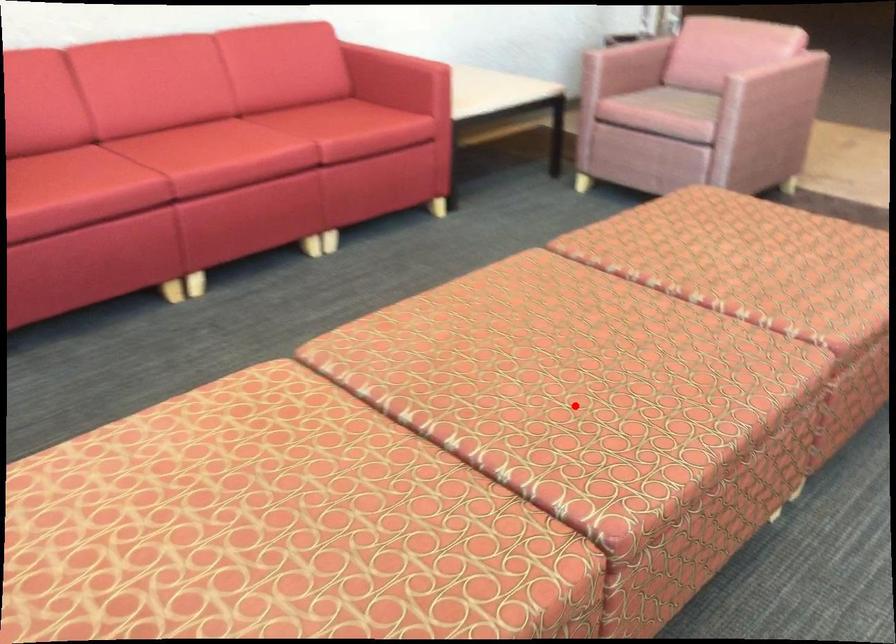
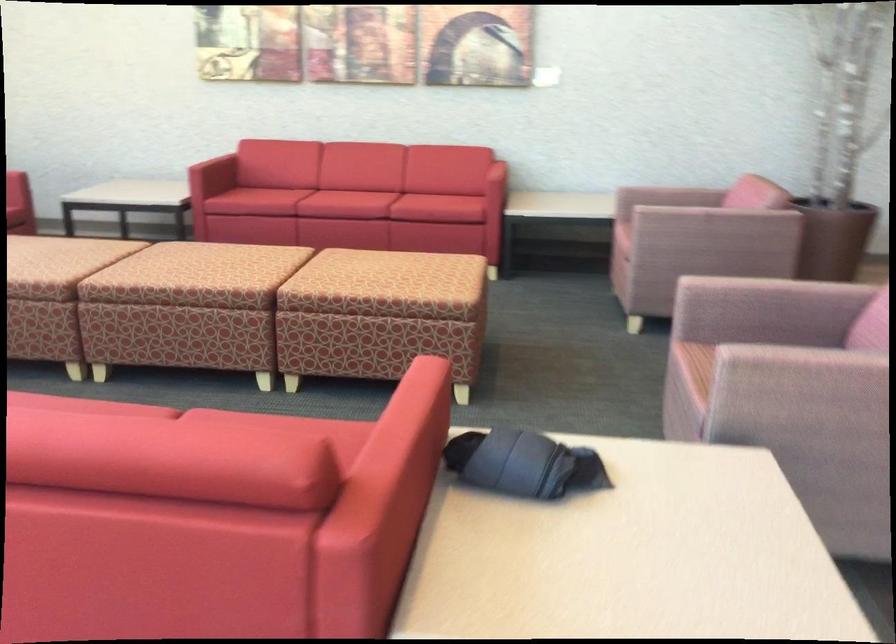
In the second image, find the point that corresponds to the highlighted location in the first image.

(186, 263)